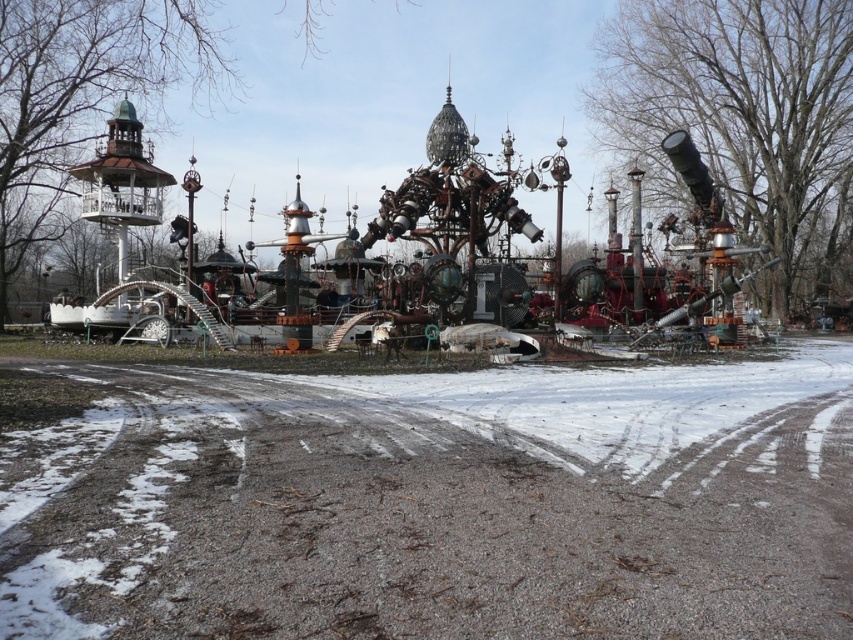
Question: Where is white powdery snow at center located in relation to rusty metal amusement park at center in the image?

Choices:
 (A) left
 (B) right

Answer: (A)

Question: Which point is farther to the camera?

Choices:
 (A) rusty metal amusement park at center
 (B) white powdery snow at center

Answer: (A)

Question: Does white powdery snow at center have a greater width compared to rusty metal amusement park at center?

Choices:
 (A) no
 (B) yes

Answer: (A)

Question: Does white powdery snow at center lie in front of rusty metal amusement park at center?

Choices:
 (A) yes
 (B) no

Answer: (A)